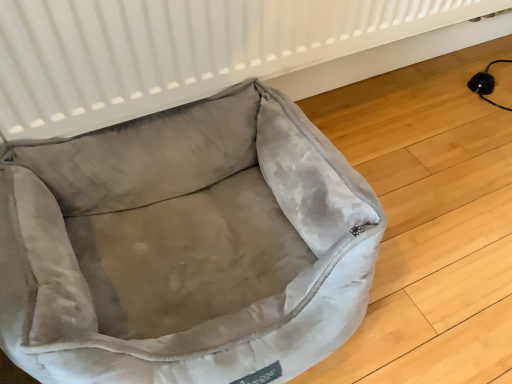
Question: Is point (355, 31) closer or farther from the camera than point (282, 269)?

Choices:
 (A) closer
 (B) farther

Answer: (B)

Question: Based on their sizes in the image, would you say white textured radiator at upper center is bigger or smaller than velvet-like beige dog bed at lower left?

Choices:
 (A) big
 (B) small

Answer: (B)

Question: From the image's perspective, is white textured radiator at upper center located above or below velvet-like beige dog bed at lower left?

Choices:
 (A) above
 (B) below

Answer: (A)

Question: From the image's perspective, relative to white textured radiator at upper center, is velvet-like beige dog bed at lower left above or below?

Choices:
 (A) above
 (B) below

Answer: (B)

Question: Visually, is velvet-like beige dog bed at lower left positioned to the left or to the right of white textured radiator at upper center?

Choices:
 (A) right
 (B) left

Answer: (B)

Question: From a real-world perspective, relative to white textured radiator at upper center, is velvet-like beige dog bed at lower left vertically above or below?

Choices:
 (A) below
 (B) above

Answer: (A)

Question: Which is correct: velvet-like beige dog bed at lower left is inside white textured radiator at upper center, or outside of it?

Choices:
 (A) inside
 (B) outside

Answer: (B)